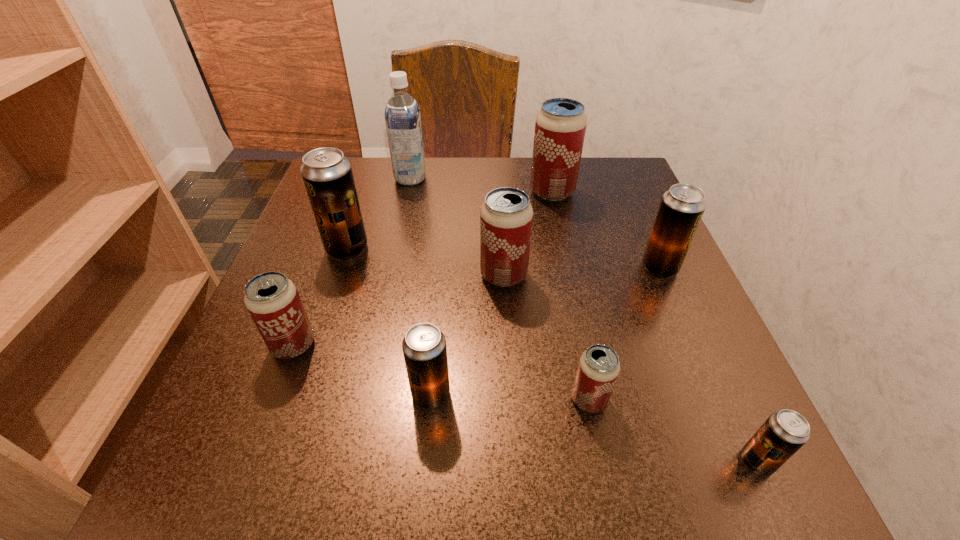
In the image, there is a desktop. Identify the location of free region at the near edge. (371, 457).

This screenshot has height=540, width=960. What are the coordinates of `free space at the left edge of the desktop` in the screenshot? It's located at (328, 316).

Where is `free space at the right edge`? free space at the right edge is located at coordinates (635, 227).

In the image, there is a desktop. Where is `vacant space at the far right corner`? vacant space at the far right corner is located at coordinates (591, 165).

You are a GUI agent. You are given a task and a screenshot of the screen. Output one action in this format:
    pyautogui.click(x=<x>, y=<y>)
    Task: Click on the vacant space at the near right corner of the desktop
    This screenshot has width=960, height=540.
    Given the screenshot: What is the action you would take?
    pyautogui.click(x=669, y=472)

You are a GUI agent. You are given a task and a screenshot of the screen. Output one action in this format:
    pyautogui.click(x=<x>, y=<y>)
    Task: Click on the vacant area that lies between the smallest red beer can and the smallest black beer can
    The image size is (960, 540).
    Given the screenshot: What is the action you would take?
    pyautogui.click(x=673, y=430)

The height and width of the screenshot is (540, 960). In order to click on free space between the fourth beer can from left to right and the biggest black beer can in this screenshot , I will do `click(425, 262)`.

I want to click on unoccupied position between the second nearest black beer can and the farthest red beer can, so [492, 293].

Identify the location of empty location between the smallest red beer can and the biggest red beer can. (570, 295).

At what (x,y) coordinates should I click in order to perform the action: click on free point between the third farthest red beer can and the nearest object. Please return your answer as a coordinate pair (x, y). Looking at the image, I should click on (525, 403).